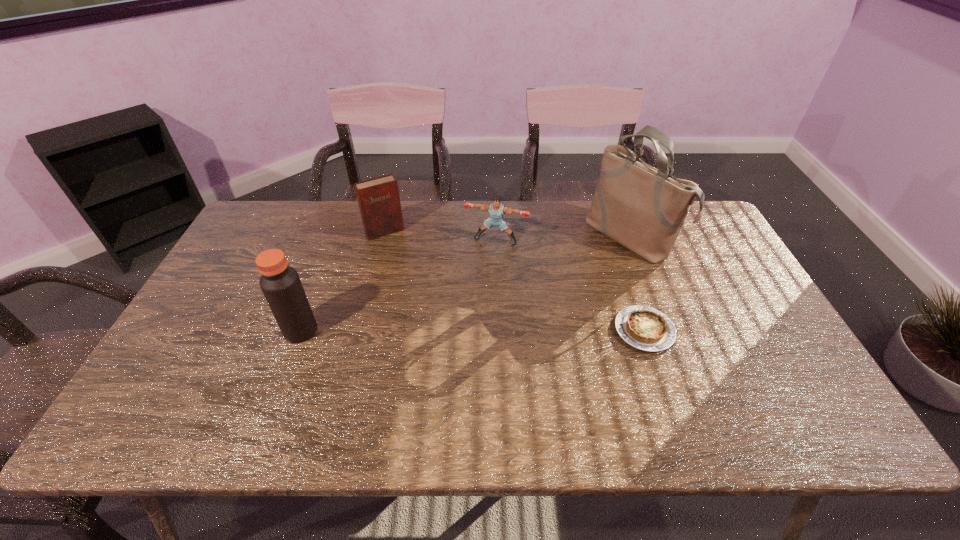
Identify which object is the third nearest to the puncher. Please provide its 2D coordinates. Your answer should be formatted as a tuple, i.e. [(x, y)], where the tuple contains the x and y coordinates of a point satisfying the conditions above.

[(645, 328)]

Locate an element on the screen. This screenshot has width=960, height=540. object that can be found as the second closest to the diary is located at coordinates tap(280, 283).

Image resolution: width=960 pixels, height=540 pixels. I want to click on vacant position in the image that satisfies the following two spatial constraints: 1. on the back side of the third object from right to left; 2. on the left side of the tallest object, so click(x=495, y=238).

The height and width of the screenshot is (540, 960). In order to click on vacant space that satisfies the following two spatial constraints: 1. on the front side of the quiche; 2. on the right side of the third tallest object in this screenshot , I will do `click(360, 330)`.

Where is `free space that satisfies the following two spatial constraints: 1. on the back side of the vinegar; 2. on the right side of the second object from left to right`? Image resolution: width=960 pixels, height=540 pixels. free space that satisfies the following two spatial constraints: 1. on the back side of the vinegar; 2. on the right side of the second object from left to right is located at coordinates (338, 232).

Where is `free space that satisfies the following two spatial constraints: 1. on the front side of the diary; 2. on the right side of the second shortest object`? This screenshot has height=540, width=960. free space that satisfies the following two spatial constraints: 1. on the front side of the diary; 2. on the right side of the second shortest object is located at coordinates (383, 240).

Image resolution: width=960 pixels, height=540 pixels. Find the location of `free spot that satisfies the following two spatial constraints: 1. on the front side of the quiche; 2. on the right side of the third object from right to left`. free spot that satisfies the following two spatial constraints: 1. on the front side of the quiche; 2. on the right side of the third object from right to left is located at coordinates (499, 330).